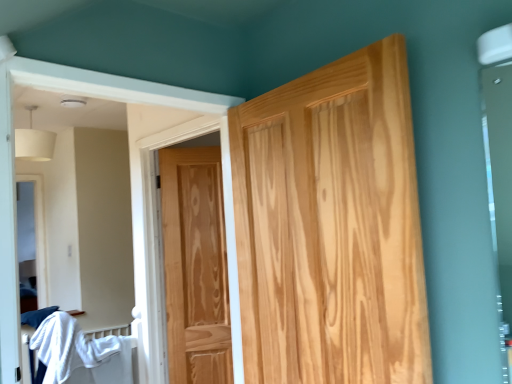
Question: Should I look upward or downward to see natural wood door at center, the first door viewed from the right?

Choices:
 (A) up
 (B) down

Answer: (B)

Question: Is white cotton bed at lower left positioned behind natural wood door at center, which ranks as the second door in left-to-right order?

Choices:
 (A) yes
 (B) no

Answer: (A)

Question: Is white cotton bed at lower left taller than natural wood door at center, which ranks as the second door in left-to-right order?

Choices:
 (A) yes
 (B) no

Answer: (B)

Question: Can you confirm if white cotton bed at lower left is wider than natural wood door at center, the first door viewed from the right?

Choices:
 (A) yes
 (B) no

Answer: (A)

Question: Is white cotton bed at lower left to the right of natural wood door at center, acting as the 1th door starting from the front, from the viewer's perspective?

Choices:
 (A) yes
 (B) no

Answer: (B)

Question: Does white cotton bed at lower left have a larger size compared to natural wood door at center, marked as the 2th door in a back-to-front arrangement?

Choices:
 (A) yes
 (B) no

Answer: (A)

Question: Is the depth of white cotton bed at lower left less than that of natural wood door at center, acting as the 1th door starting from the front?

Choices:
 (A) no
 (B) yes

Answer: (A)

Question: Considering the relative sizes of natural wood door at center, the 2th door in the right-to-left sequence, and white cotton bed at lower left in the image provided, is natural wood door at center, the 2th door in the right-to-left sequence, thinner than white cotton bed at lower left?

Choices:
 (A) no
 (B) yes

Answer: (B)

Question: Is natural wood door at center, which is the 1th door in back-to-front order, facing towards white cotton bed at lower left?

Choices:
 (A) yes
 (B) no

Answer: (B)

Question: Is natural wood door at center, which is the 1th door in back-to-front order, touching white cotton bed at lower left?

Choices:
 (A) no
 (B) yes

Answer: (A)

Question: Does natural wood door at center, the 2th door in the right-to-left sequence, have a larger size compared to white cotton bed at lower left?

Choices:
 (A) no
 (B) yes

Answer: (A)

Question: Is natural wood door at center, placed as the 1th door when sorted from left to right, further to the viewer compared to white cotton bed at lower left?

Choices:
 (A) no
 (B) yes

Answer: (B)

Question: Is the position of natural wood door at center, positioned as the second door in front-to-back order, less distant than that of white cotton bed at lower left?

Choices:
 (A) yes
 (B) no

Answer: (B)

Question: From the image's perspective, is white cotton bed at lower left below natural wood door at center, which is the 1th door in back-to-front order?

Choices:
 (A) no
 (B) yes

Answer: (B)